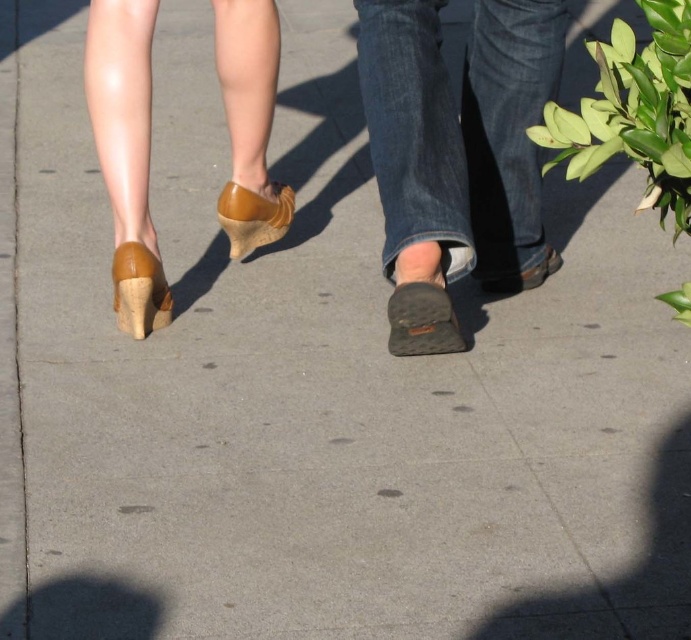
Question: Is matte brown wedge shoes at left smaller than leather slip-on shoe at center?

Choices:
 (A) yes
 (B) no

Answer: (B)

Question: Which point is farther to the camera?

Choices:
 (A) dark brown suede shoe at center
 (B) matte brown sandal at center

Answer: (B)

Question: Among these points, which one is nearest to the camera?

Choices:
 (A) (462, 106)
 (B) (245, 211)

Answer: (A)

Question: Which point is closer to the camera?

Choices:
 (A) (457, 328)
 (B) (547, 273)
 (C) (507, 154)

Answer: (A)

Question: Is matte brown wedge shoes at left wider than leather shoe at center?

Choices:
 (A) yes
 (B) no

Answer: (A)

Question: Is dark brown suede shoe at center in front of leather shoe at center?

Choices:
 (A) yes
 (B) no

Answer: (B)